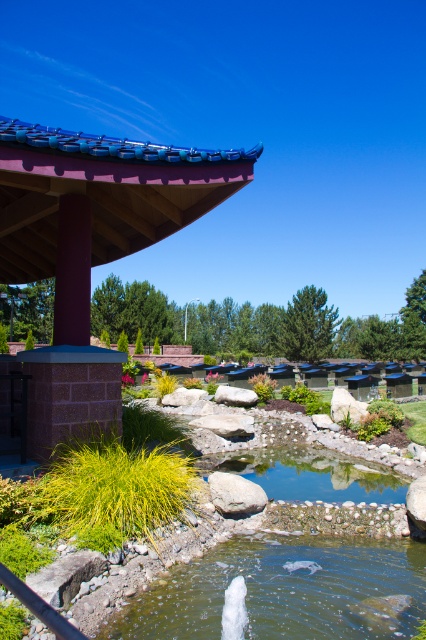
Can you confirm if matte brick gazebo at upper left is positioned above clear glass water at center?

Yes, matte brick gazebo at upper left is above clear glass water at center.

This screenshot has width=426, height=640. What do you see at coordinates (91, 248) in the screenshot? I see `matte brick gazebo at upper left` at bounding box center [91, 248].

I want to click on matte brick gazebo at upper left, so click(x=91, y=248).

Find the location of `matte brick gazebo at upper left`. matte brick gazebo at upper left is located at coordinates (91, 248).

Is clear glass water at center closer to camera compared to gray rough rock at center?

No, clear glass water at center is behind gray rough rock at center.

Does clear glass water at center appear on the left side of gray rough rock at center?

In fact, clear glass water at center is to the right of gray rough rock at center.

Is point (287, 461) positioned after point (222, 476)?

Yes, it is behind point (222, 476).

Identify the location of clear glass water at center. (310, 474).

Can you confirm if green liquid water at lower center is wider than gray rough rock at center?

Yes.

Does green liquid water at lower center have a larger size compared to gray rough rock at center?

Yes, green liquid water at lower center is bigger than gray rough rock at center.

The width and height of the screenshot is (426, 640). I want to click on green liquid water at lower center, so click(x=284, y=592).

This screenshot has width=426, height=640. I want to click on green liquid water at lower center, so click(x=284, y=592).